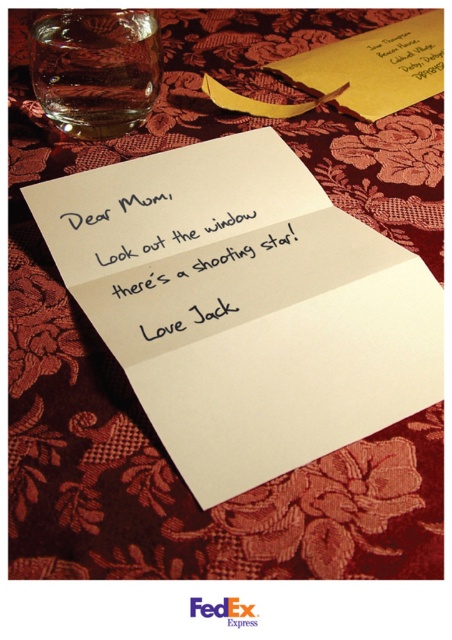
Question: Does white paper at center appear under yellow paper envelope at upper center?

Choices:
 (A) no
 (B) yes

Answer: (B)

Question: Can you confirm if yellow paper envelope at upper center is positioned below colored paper note at upper right?

Choices:
 (A) yes
 (B) no

Answer: (A)

Question: Does white paper at center appear under colored paper note at upper right?

Choices:
 (A) no
 (B) yes

Answer: (B)

Question: Which object is the closest to the colored paper note at upper right?

Choices:
 (A) white paper at center
 (B) yellow paper envelope at upper center

Answer: (B)

Question: Which point is farther to the camera?

Choices:
 (A) colored paper note at upper right
 (B) yellow paper envelope at upper center
 (C) white paper at center

Answer: (A)

Question: Which of the following is the farthest from the observer?

Choices:
 (A) (287, 108)
 (B) (263, 273)
 (C) (427, 67)

Answer: (C)